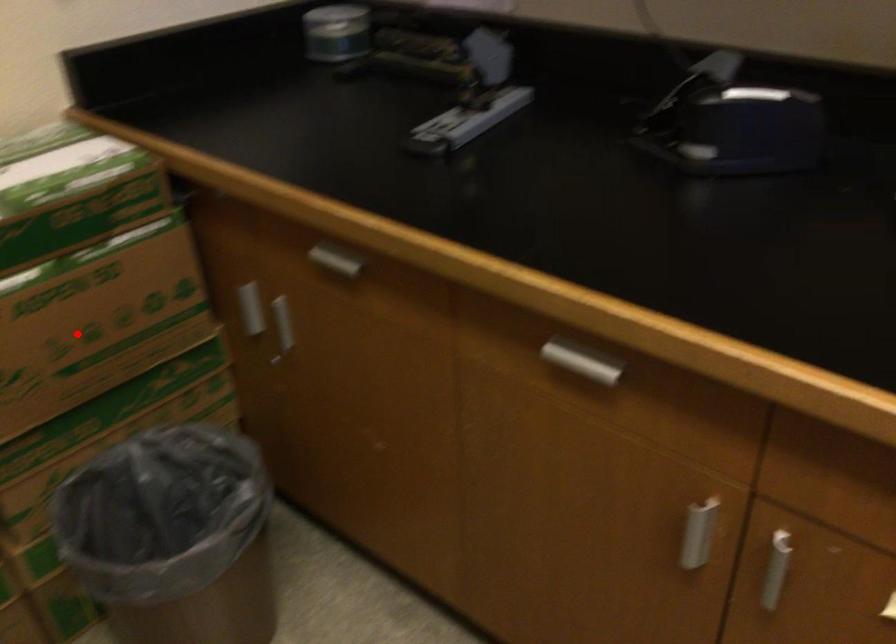
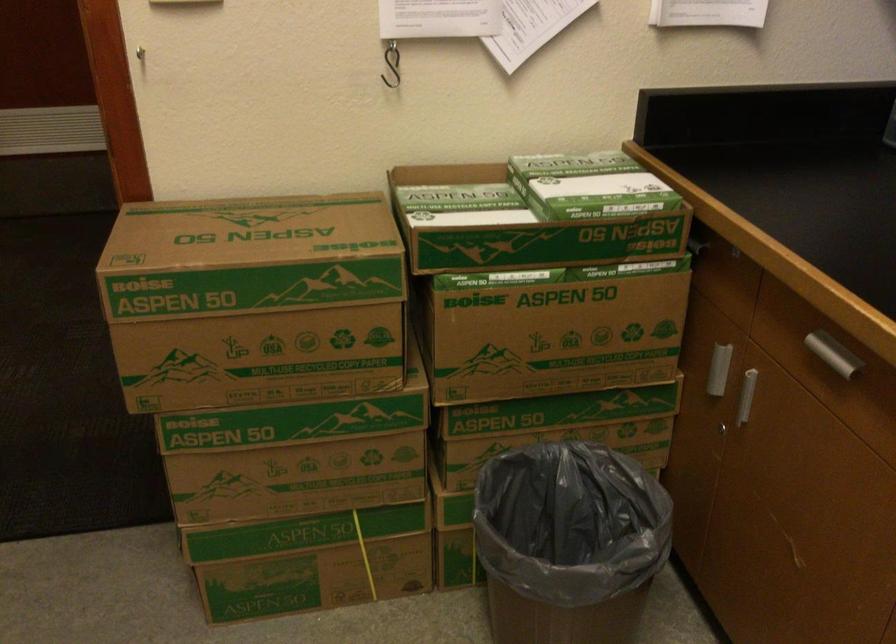
Locate, in the second image, the point that corresponds to the highlighted location in the first image.

(552, 337)